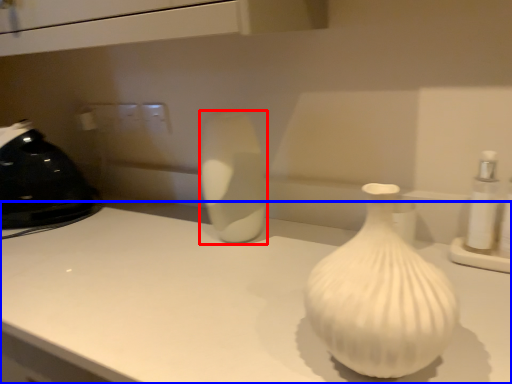
Question: Which object is closer to the camera taking this photo, vase (highlighted by a red box) or counter top (highlighted by a blue box)?

Choices:
 (A) vase
 (B) counter top

Answer: (B)